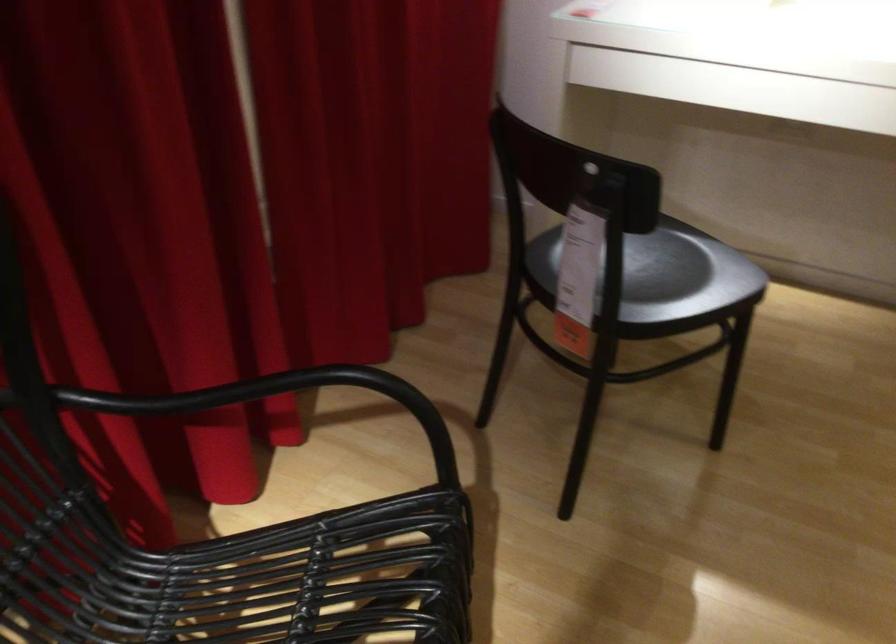
I want to click on wicker chair sitting surface, so click(x=664, y=265).